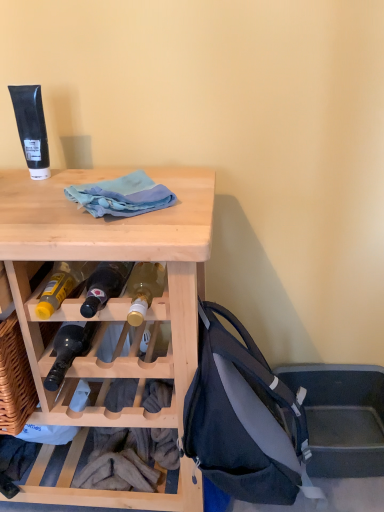
Question: From a real-world perspective, relative to matte black backpack at lower right, is natural wood desk at upper left vertically above or below?

Choices:
 (A) above
 (B) below

Answer: (B)

Question: Looking at their shapes, would you say natural wood desk at upper left is wider or thinner than matte black backpack at lower right?

Choices:
 (A) thin
 (B) wide

Answer: (B)

Question: Which of these objects is positioned farthest from the light blue fabric at center?

Choices:
 (A) matte black backpack at lower right
 (B) natural wood desk at upper left

Answer: (A)

Question: Which of these objects is positioned farthest from the matte black backpack at lower right?

Choices:
 (A) light blue fabric at center
 (B) natural wood desk at upper left

Answer: (A)